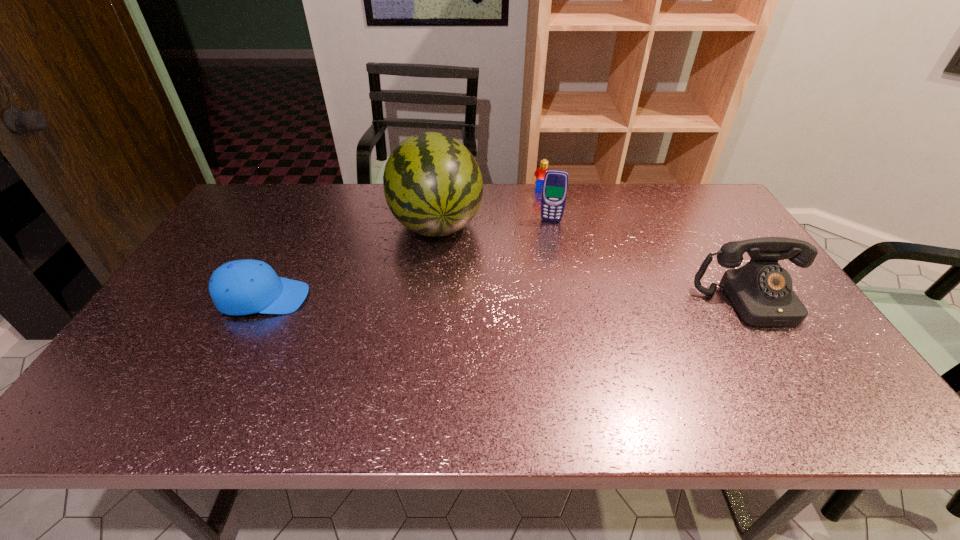
Image resolution: width=960 pixels, height=540 pixels. In order to click on vacant space on the desktop that is between the leftmost object and the rightmost object and is positioned on the front-facing side of the farthest object in this screenshot , I will do `click(500, 300)`.

At what (x,y) coordinates should I click in order to perform the action: click on free space on the desktop that is between the leftmost object and the telephone and is positioned at the stem end of the watermelon. Please return your answer as a coordinate pair (x, y). The width and height of the screenshot is (960, 540). Looking at the image, I should click on (457, 299).

This screenshot has height=540, width=960. Find the location of `free spot on the desktop that is between the cap and the telephone and is positioned on the front-facing side of the cellular telephone`. free spot on the desktop that is between the cap and the telephone and is positioned on the front-facing side of the cellular telephone is located at coordinates (540, 300).